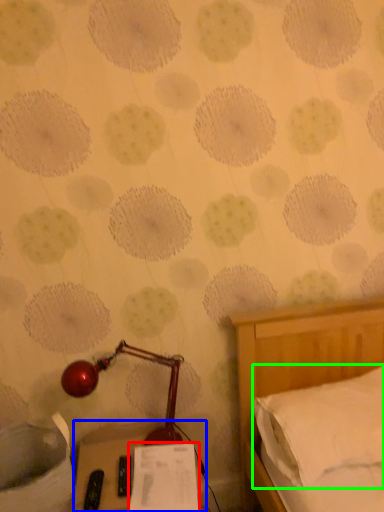
Question: Which object is positioned farthest from paper (highlighted by a red box)? Select from furniture (highlighted by a blue box) and pillow (highlighted by a green box).

Choices:
 (A) furniture
 (B) pillow

Answer: (B)